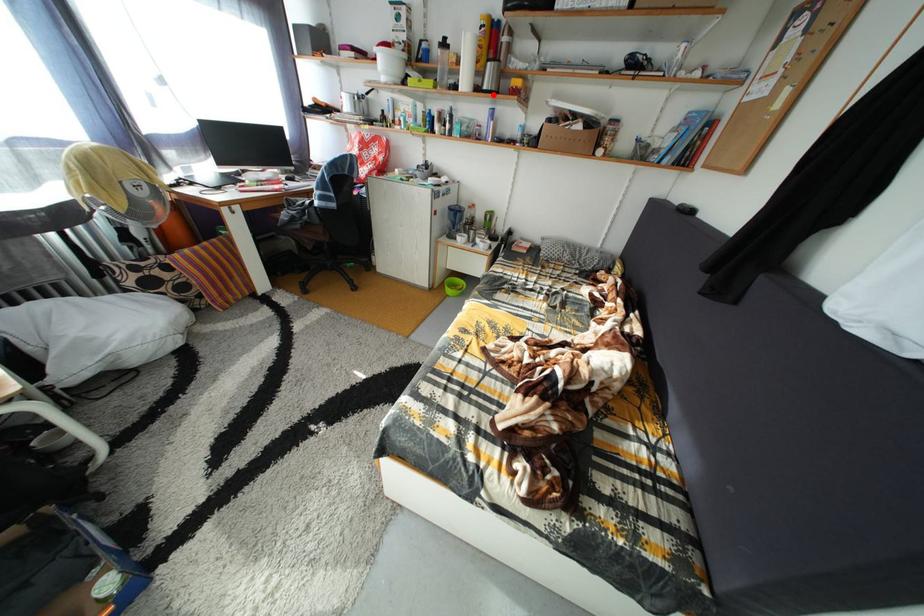
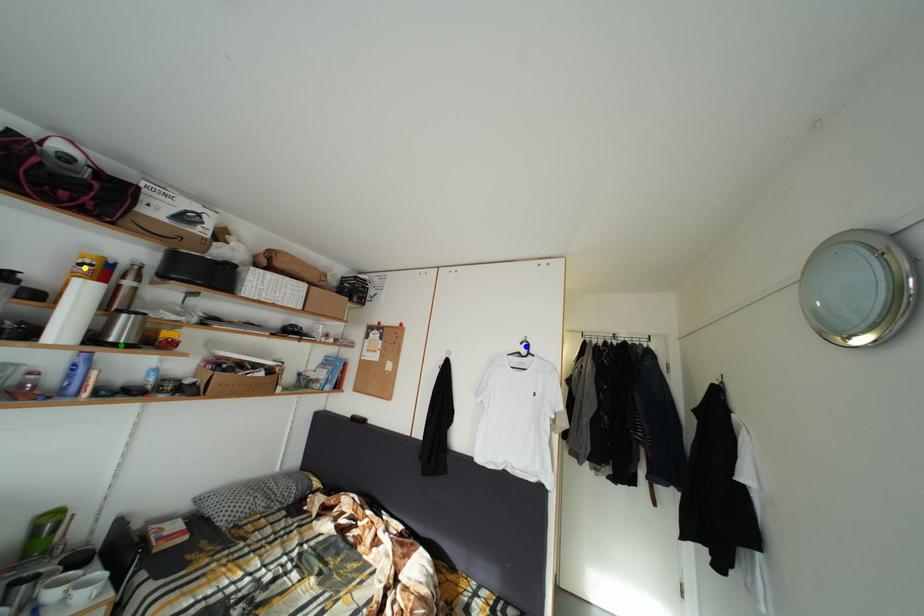
Question: I am providing you with two images of the same scene from different viewpoints. A red point is marked on the first image. You are given multiple points on the second image. In image 2, which mark is for the same physical point as the one in image 1?

Choices:
 (A) yellow point
 (B) blue point
 (C) green point

Answer: (C)